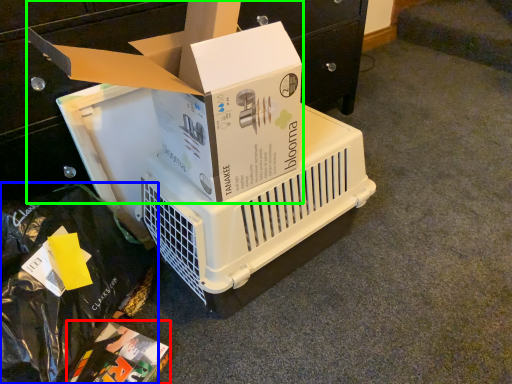
Question: Which object is positioned closest to box (highlighted by a red box)? Select from garbage (highlighted by a blue box) and box (highlighted by a green box).

Choices:
 (A) garbage
 (B) box

Answer: (A)